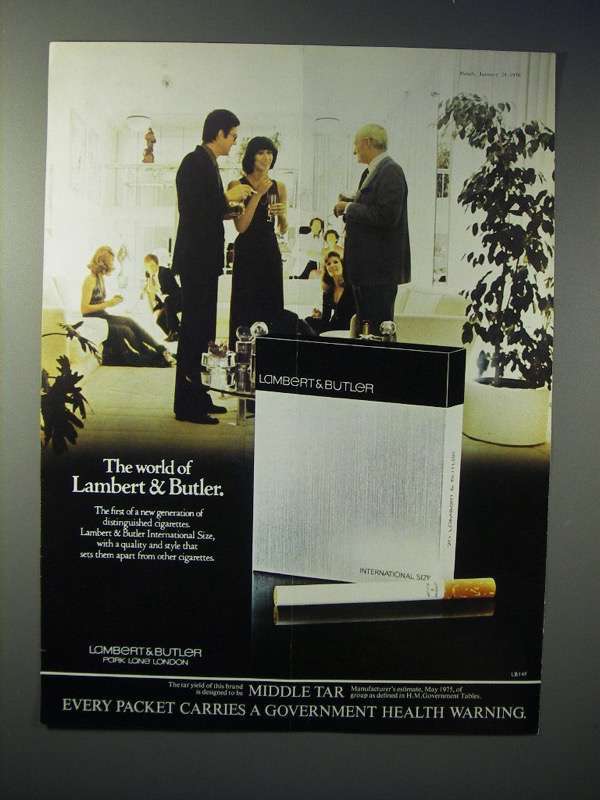
Image resolution: width=600 pixels, height=800 pixels. I want to click on white wall, so click(x=276, y=82).